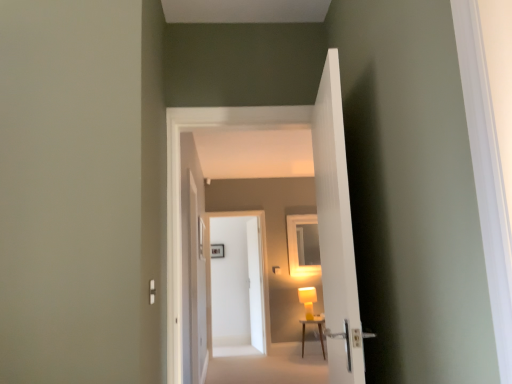
Question: Can we say white glossy door at center, marked as the third door in a front-to-back arrangement, lies outside white glossy door at center, arranged as the fourth door when viewed from the front?

Choices:
 (A) no
 (B) yes

Answer: (B)

Question: Are white glossy door at center, which is the second door in back-to-front order, and white glossy door at center, arranged as the fourth door when viewed from the front, located far from each other?

Choices:
 (A) yes
 (B) no

Answer: (B)

Question: From a real-world perspective, is white glossy door at center, marked as the third door in a front-to-back arrangement, physically below white glossy door at center, arranged as the fourth door when viewed from the front?

Choices:
 (A) yes
 (B) no

Answer: (A)

Question: From the image's perspective, is white glossy door at center, marked as the third door in a front-to-back arrangement, over white glossy door at center, arranged as the fourth door when viewed from the front?

Choices:
 (A) yes
 (B) no

Answer: (A)

Question: Can you confirm if white glossy door at center, which is the second door in back-to-front order, is shorter than white glossy door at center, the first door from the back?

Choices:
 (A) yes
 (B) no

Answer: (A)

Question: Considering the relative sizes of white glossy door at center, which is the second door in back-to-front order, and white glossy door at center, arranged as the fourth door when viewed from the front, in the image provided, is white glossy door at center, which is the second door in back-to-front order, taller than white glossy door at center, arranged as the fourth door when viewed from the front,?

Choices:
 (A) no
 (B) yes

Answer: (A)

Question: Is white carpet at lower center not close to wooden table at center?

Choices:
 (A) no
 (B) yes

Answer: (B)

Question: Can you confirm if white carpet at lower center is taller than wooden table at center?

Choices:
 (A) no
 (B) yes

Answer: (A)

Question: Could you tell me if white carpet at lower center is turned towards wooden table at center?

Choices:
 (A) yes
 (B) no

Answer: (B)

Question: Is wooden table at center surrounded by white carpet at lower center?

Choices:
 (A) yes
 (B) no

Answer: (B)

Question: Can you confirm if white carpet at lower center is bigger than wooden table at center?

Choices:
 (A) no
 (B) yes

Answer: (B)

Question: From a real-world perspective, is white carpet at lower center over wooden table at center?

Choices:
 (A) yes
 (B) no

Answer: (B)

Question: Is matte yellow lamp at center not near white glossy door at center, the first door from the back?

Choices:
 (A) yes
 (B) no

Answer: (A)